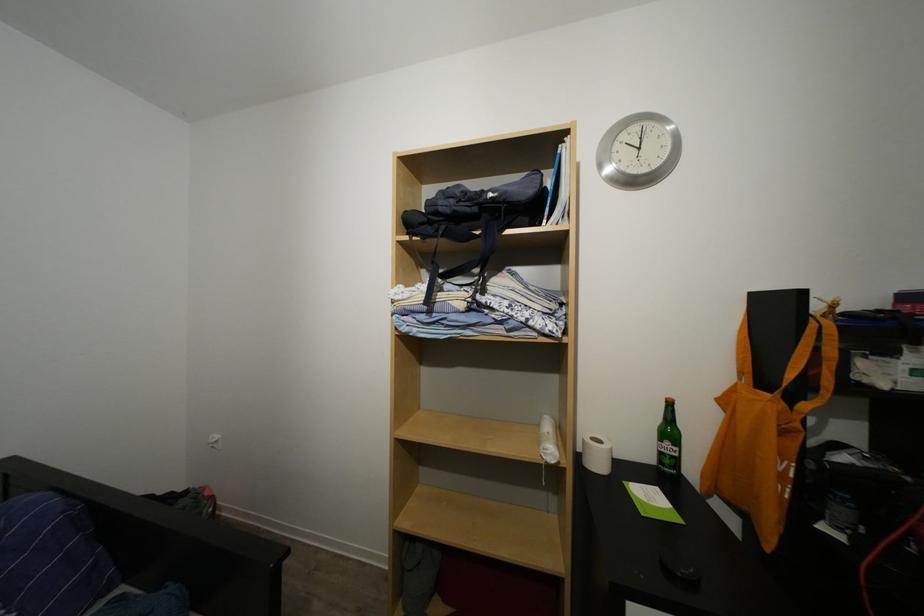
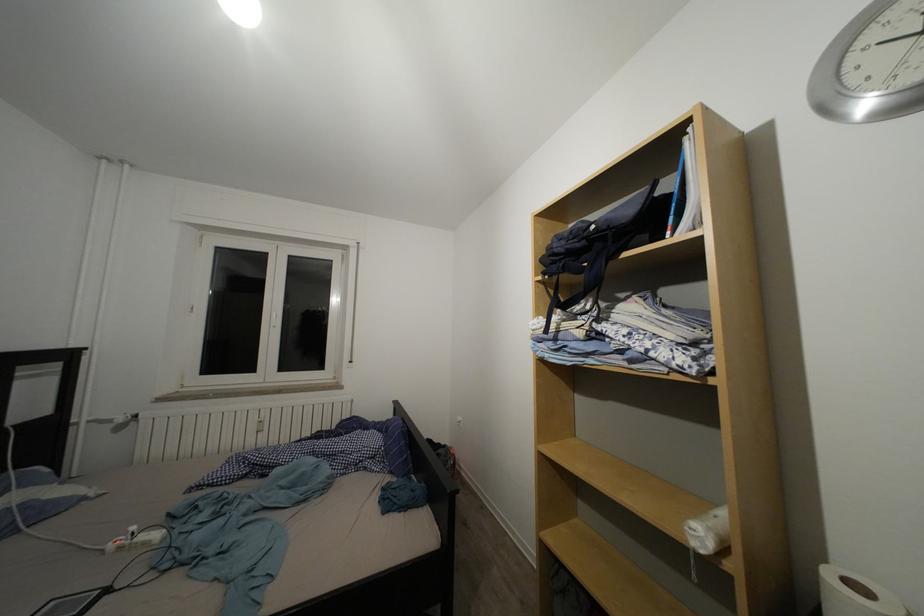
Question: The first image is from the beginning of the video and the second image is from the end. How did the camera likely rotate when shooting the video?

Choices:
 (A) Left
 (B) Right
 (C) Up
 (D) Down

Answer: (A)